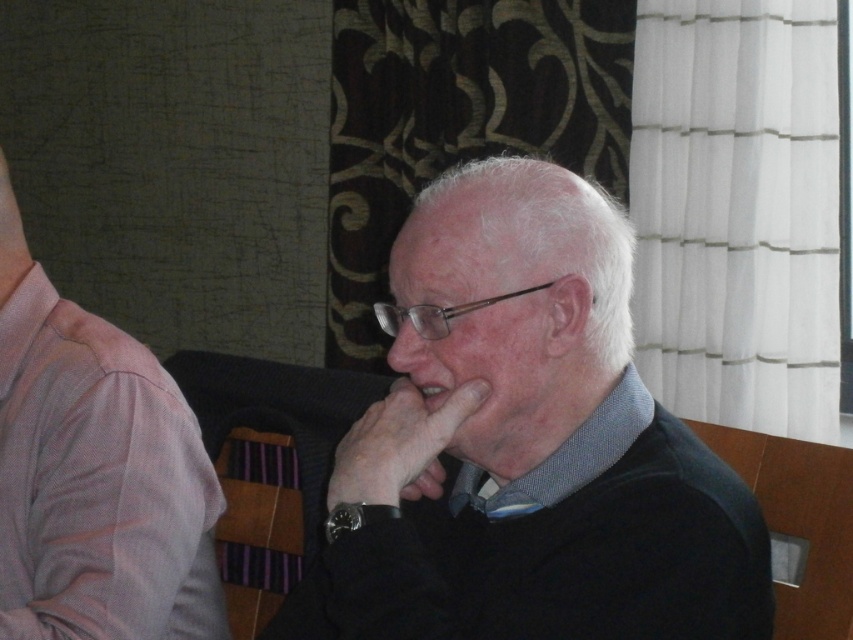
Question: Which point is closer to the camera?

Choices:
 (A) (363, 480)
 (B) (343, 444)
 (C) (167, 506)
 (D) (427, 339)

Answer: (A)

Question: In this image, where is matte black sweater at center located relative to matte glass nose at center?

Choices:
 (A) left
 (B) right

Answer: (B)

Question: Does matte black face at center appear on the right side of matte glass nose at center?

Choices:
 (A) yes
 (B) no

Answer: (A)

Question: Can you confirm if pink fabric shirt at left is positioned to the right of matte black face at center?

Choices:
 (A) no
 (B) yes

Answer: (A)

Question: Which point is closer to the camera?

Choices:
 (A) (202, 614)
 (B) (467, 435)
 (C) (368, 496)

Answer: (C)

Question: Which point is closer to the camera?

Choices:
 (A) pink fabric shirt at left
 (B) smooth skin hand at center
 (C) matte black face at center

Answer: (B)